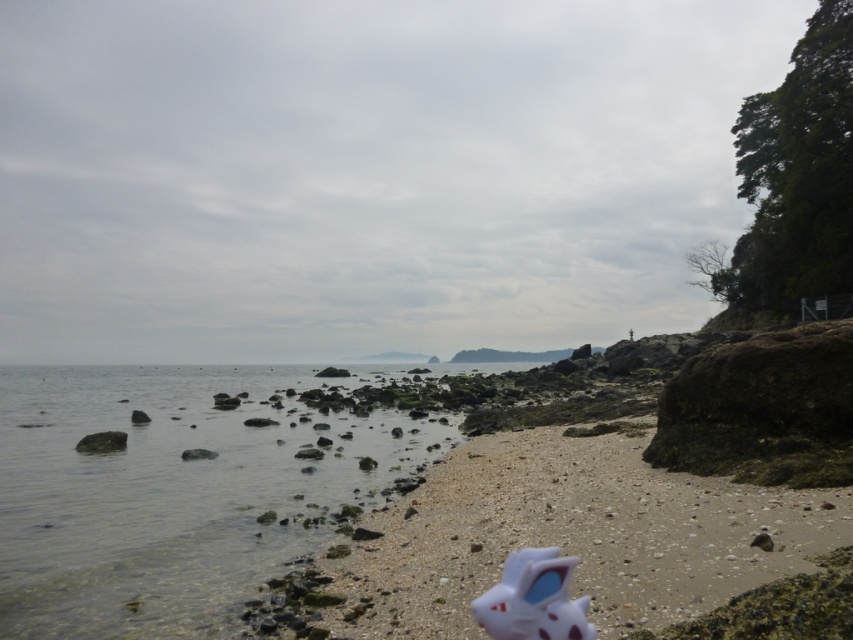
You are a photographer taking a picture of the beach. You want to capture both the clear water at beach left and the white matte toy at lower center in your shot. Which object should you position closer to the left side of the frame?

The clear water at beach left should be positioned closer to the left side of the frame because it is already located to the left of the white matte toy at lower center.

Looking at this image, you are standing on the beach and want to place the white matte toy at lower center into the clear water at beach left. Can you walk directly to the water without needing to move any obstacles?

The clear water at beach left and white matte toy at lower center are 56.00 meters apart. Since the distance is quite large, you would need to walk a considerable distance to reach the water from the toy, but there are no mentioned obstacles in the scene description, so the path should be clear.